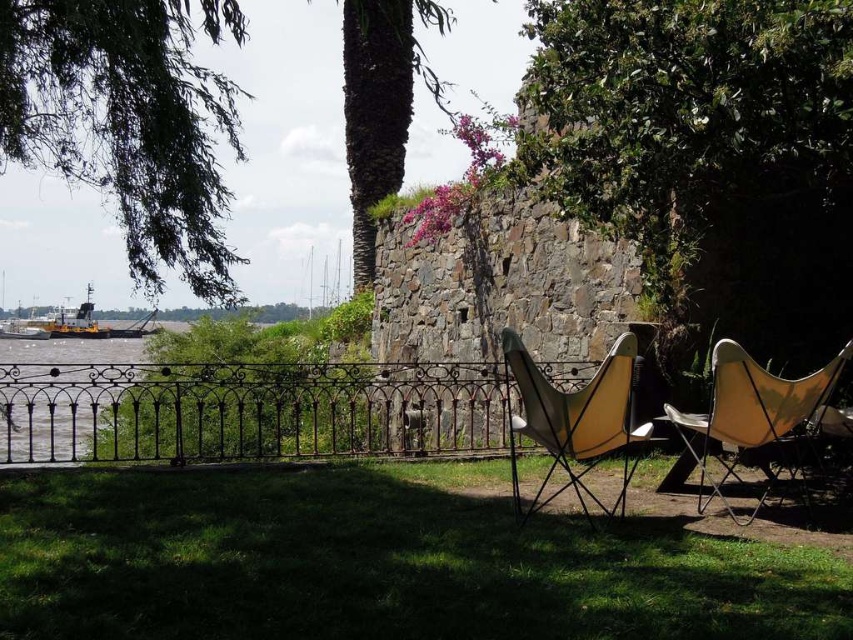
Looking at this image, between brown textured palm tree at center and matte yellow chair at center, which one appears on the right side from the viewer's perspective?

matte yellow chair at center is more to the right.

Is brown textured palm tree at center positioned before matte yellow chair at center?

No, brown textured palm tree at center is further to the viewer.

I want to click on brown textured palm tree at center, so click(x=374, y=113).

Can you confirm if green leafy tree at upper left is thinner than yellow matte boat at lower left?

In fact, green leafy tree at upper left might be wider than yellow matte boat at lower left.

Who is more forward, (221,296) or (90,308)?

Point (221,296) is in front.

Is point (161, 218) positioned before point (68, 316)?

That is True.

This screenshot has height=640, width=853. Identify the location of green leafy tree at upper left. (129, 122).

Which is behind, point (248, 93) or point (722, 461)?

Positioned behind is point (248, 93).

What do you see at coordinates (129, 122) in the screenshot? The width and height of the screenshot is (853, 640). I see `green leafy tree at upper left` at bounding box center [129, 122].

I want to click on green leafy tree at upper left, so click(129, 122).

Find the location of a particular element. The height and width of the screenshot is (640, 853). green leafy tree at upper left is located at coordinates (129, 122).